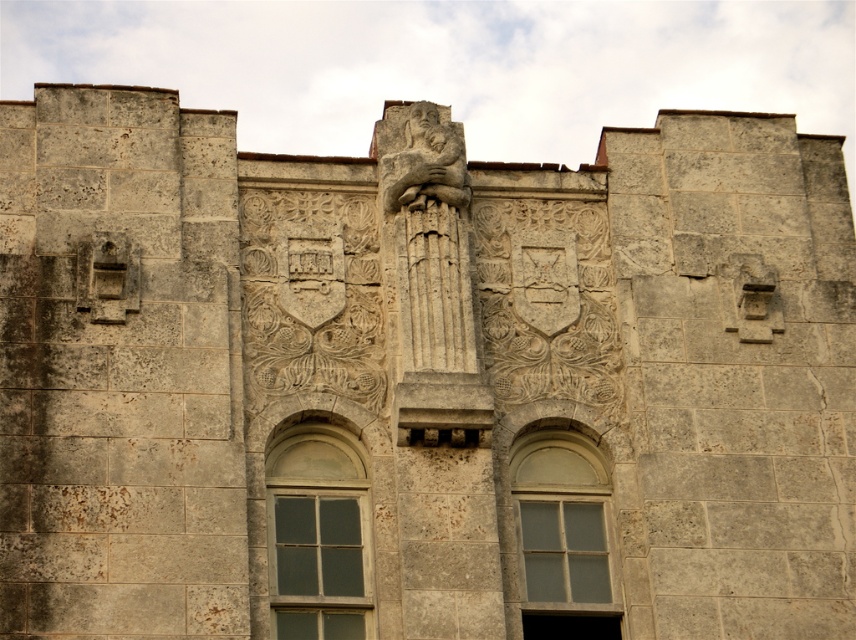
Question: Does matte stone window at center have a smaller size compared to clear glass window at center?

Choices:
 (A) no
 (B) yes

Answer: (A)

Question: Is matte stone window at center to the left of clear glass window at center from the viewer's perspective?

Choices:
 (A) no
 (B) yes

Answer: (B)

Question: Considering the relative positions of matte stone window at center and clear glass window at center in the image provided, where is matte stone window at center located with respect to clear glass window at center?

Choices:
 (A) above
 (B) below

Answer: (B)

Question: Which point appears closest to the camera in this image?

Choices:
 (A) (605, 570)
 (B) (354, 621)

Answer: (B)

Question: Which point is closer to the camera?

Choices:
 (A) (593, 497)
 (B) (272, 468)

Answer: (B)